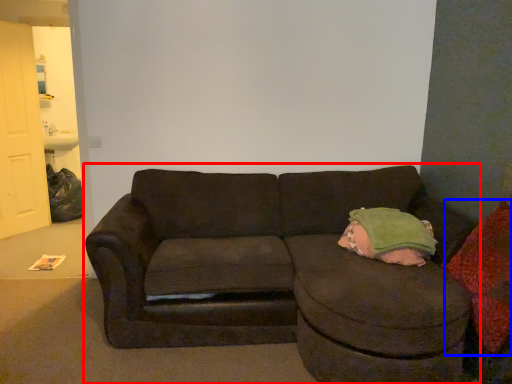
Question: Which of the following is the farthest to the observer, studio couch (highlighted by a red box) or throw pillow (highlighted by a blue box)?

Choices:
 (A) studio couch
 (B) throw pillow

Answer: (B)